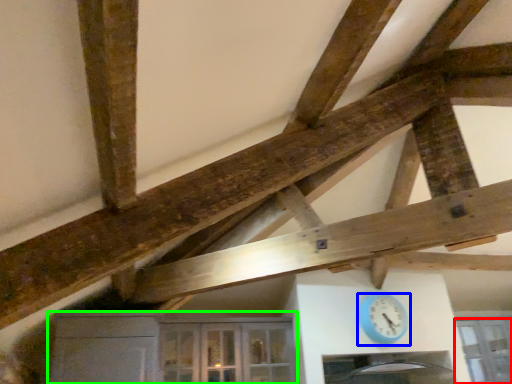
Question: Estimate the real-world distances between objects in this image. Which object is farther from window (highlighted by a red box), clock (highlighted by a blue box) or cabinetry (highlighted by a green box)?

Choices:
 (A) clock
 (B) cabinetry

Answer: (B)